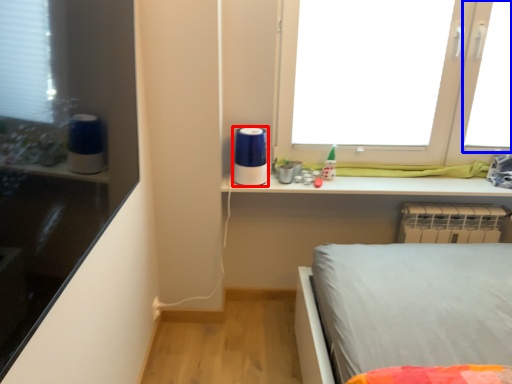
Question: Which object appears closest to the camera in this image, appliance (highlighted by a red box) or window screen (highlighted by a blue box)?

Choices:
 (A) appliance
 (B) window screen

Answer: (A)